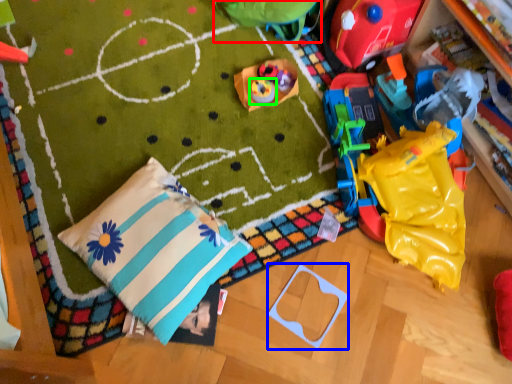
Question: Which object is positioned farthest from toy (highlighted by a red box)? Select from toy (highlighted by a blue box) and toy (highlighted by a green box).

Choices:
 (A) toy
 (B) toy

Answer: (A)